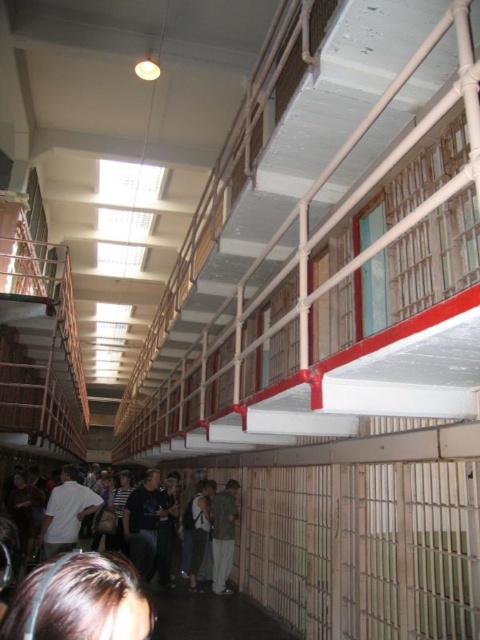
Question: Among these points, which one is nearest to the camera?

Choices:
 (A) (220, 528)
 (B) (104, 593)
 (C) (69, 547)
 (D) (195, 589)

Answer: (B)

Question: Is dark brown leather jacket at lower left thinner than white matte shirt at lower left?

Choices:
 (A) no
 (B) yes

Answer: (B)

Question: Which point is closer to the camera?

Choices:
 (A) green fabric jacket at center
 (B) dark brown leather jacket at lower left
 (C) white matte shirt at lower left

Answer: (B)

Question: In this image, where is dark brown leather jacket at lower left located relative to green fabric jacket at center?

Choices:
 (A) below
 (B) above

Answer: (B)

Question: Is white matte shirt at lower left in front of green fabric jacket at center?

Choices:
 (A) no
 (B) yes

Answer: (B)

Question: Which object is positioned closest to the brown hair at lower left?

Choices:
 (A) white matte shirt at lower left
 (B) dark brown leather jacket at lower left
 (C) green fabric jacket at center

Answer: (B)